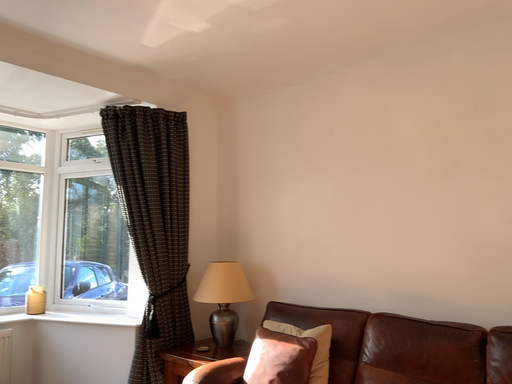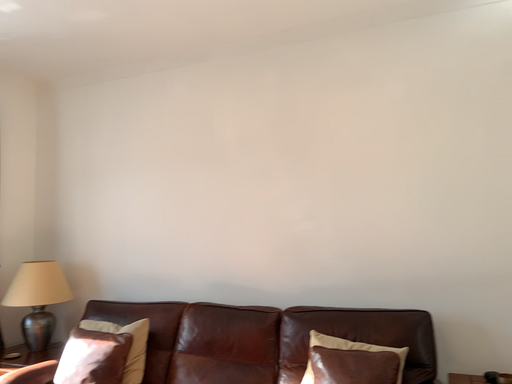
Question: Which way did the camera rotate in the video?

Choices:
 (A) rotated left
 (B) rotated right

Answer: (B)